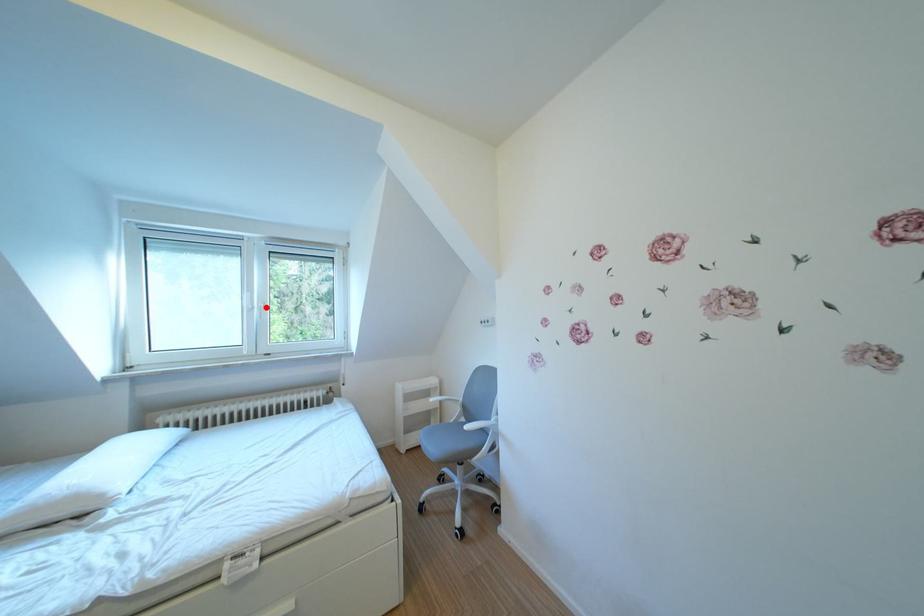
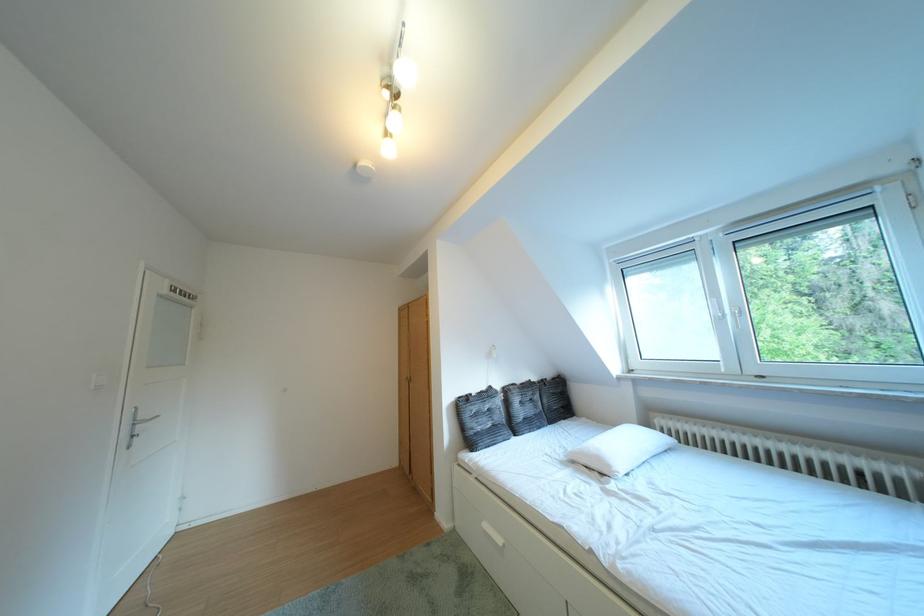
In the second image, find the point that corresponds to the highlighted location in the first image.

(736, 315)